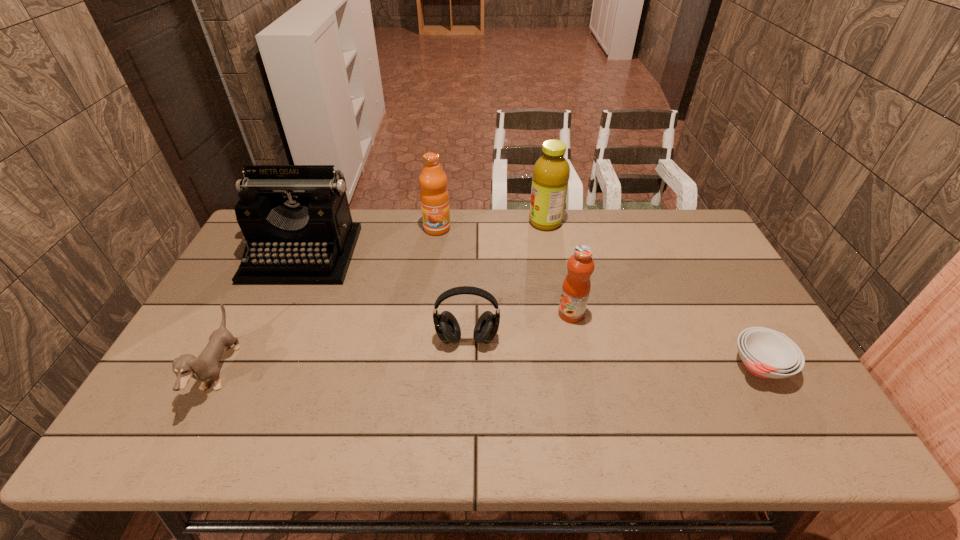
The image size is (960, 540). Identify the location of the leftmost fruit juice. [434, 196].

The image size is (960, 540). What are the coordinates of `typewriter` in the screenshot? It's located at (296, 220).

Find the location of a particular element. This screenshot has width=960, height=540. the nearest fruit juice is located at coordinates 576,287.

Where is `the shortest fruit juice`? the shortest fruit juice is located at coordinates (576, 287).

Image resolution: width=960 pixels, height=540 pixels. What are the coordinates of `headset` in the screenshot? It's located at (447, 327).

Locate an element on the screen. The height and width of the screenshot is (540, 960). the sixth tallest object is located at coordinates pos(205,367).

Find the location of a particular element. The height and width of the screenshot is (540, 960). soup bowl is located at coordinates (766, 353).

You are a GUI agent. You are given a task and a screenshot of the screen. Output one action in this format:
    pyautogui.click(x=<x>, y=<y>)
    Task: Click on the shortest object
    The width and height of the screenshot is (960, 540).
    Given the screenshot: What is the action you would take?
    click(766, 353)

At what (x,y) coordinates should I click in order to perform the action: click on free region located on the label side of the leftmost fruit juice. Please return your answer as a coordinate pair (x, y). The width and height of the screenshot is (960, 540). Looking at the image, I should click on (431, 278).

The image size is (960, 540). In order to click on vacant area situated 0.140m on the typing side of the typewriter in this screenshot , I will do `click(273, 320)`.